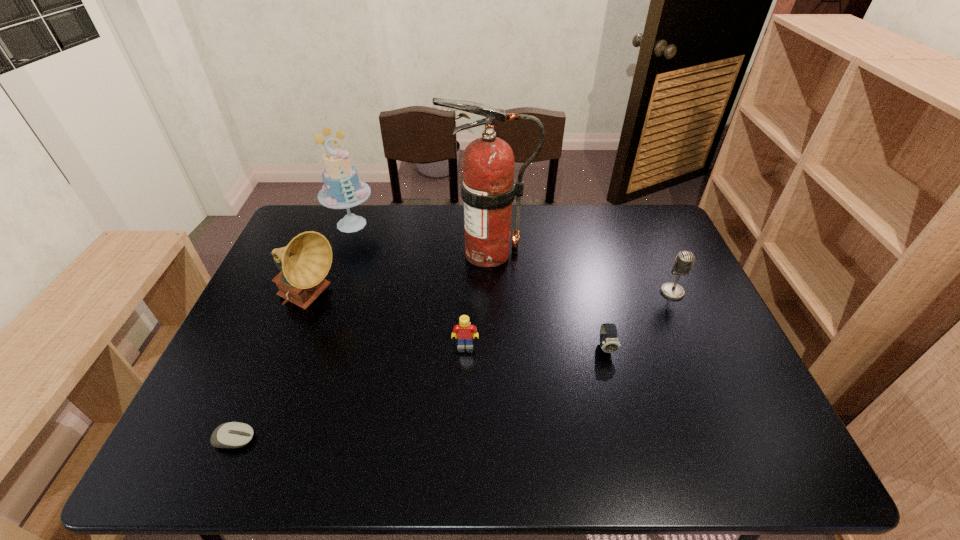
Locate an element on the screen. The width and height of the screenshot is (960, 540). the tallest object is located at coordinates (488, 187).

Where is `the second tallest object`? The height and width of the screenshot is (540, 960). the second tallest object is located at coordinates (x=342, y=188).

The image size is (960, 540). Find the location of `the fifth shortest object`. the fifth shortest object is located at coordinates (306, 260).

The width and height of the screenshot is (960, 540). I want to click on the fourth shortest object, so click(684, 260).

Identify the location of microphone. The image size is (960, 540). (684, 260).

The image size is (960, 540). I want to click on Lego, so click(465, 332).

Locate an element on the screen. the second shortest object is located at coordinates (609, 343).

This screenshot has width=960, height=540. I want to click on the second object from right to left, so click(x=609, y=343).

This screenshot has height=540, width=960. What are the coordinates of `computer equipment` in the screenshot? It's located at (232, 434).

At what (x,y) coordinates should I click in order to perform the action: click on the nearest object. Please return your answer as a coordinate pair (x, y). Looking at the image, I should click on (232, 434).